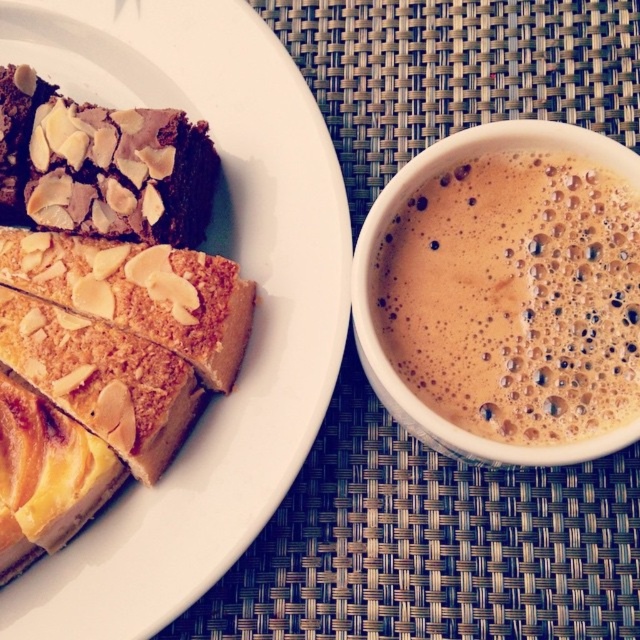
You are at a cafe and want to choose the larger item between the brown frothy coffee at right and the golden crumbly slice at upper left. Which one should you pick?

The golden crumbly slice at upper left is larger than the brown frothy coffee at right, so you should pick the golden crumbly slice at upper left.

You are a waiter trying to place a dessert plate and a coffee cup on a table. The dessert plate is at point [326,234] and the coffee cup is at point [598,385]. According to the image, which object is closer to the viewer?

Point [598,385] is closer to the viewer than point [326,234] because the Objects Description states that point [326,234] is behind point [598,385].

You are at a cafe and want to move your hand from the brown matte cake at left to the brown frothy coffee at right. Which direction should you move your hand?

Since the brown matte cake at left is to the left of the brown frothy coffee at right, you should move your hand to the right to reach the coffee.